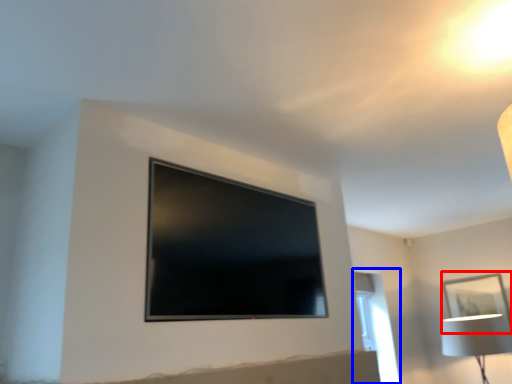
Question: Which point is closer to the camera, picture frame (highlighted by a red box) or window (highlighted by a blue box)?

Choices:
 (A) picture frame
 (B) window

Answer: (B)